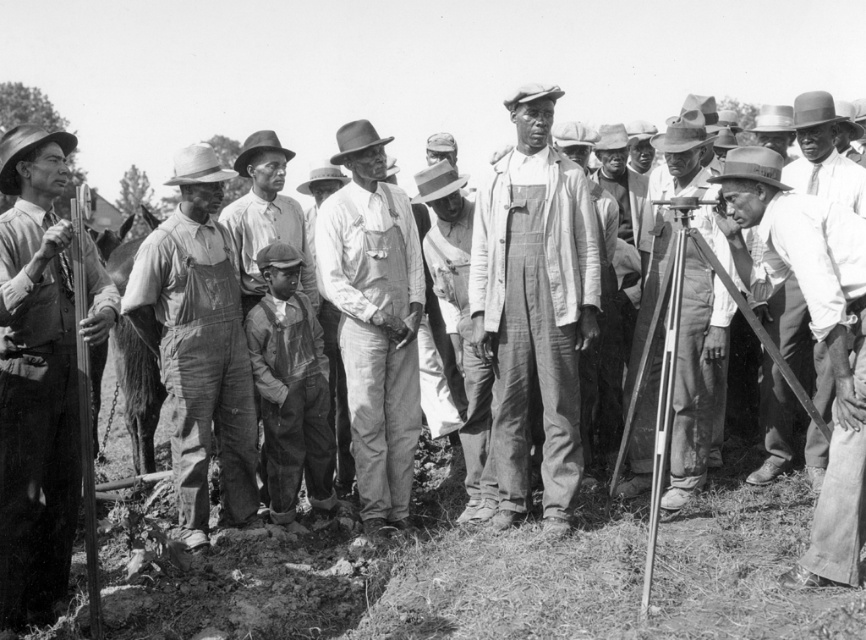
Looking at this image, who is positioned more to the left, matte gray overalls at center or matte metal rod at left?

matte metal rod at left

Where is `matte gray overalls at center`? matte gray overalls at center is located at coordinates (534, 307).

This screenshot has height=640, width=866. What do you see at coordinates (36, 380) in the screenshot? I see `matte metal rod at left` at bounding box center [36, 380].

You are a GUI agent. You are given a task and a screenshot of the screen. Output one action in this format:
    pyautogui.click(x=<x>, y=<y>)
    Task: Click on the matte metal rod at left
    
    Given the screenshot: What is the action you would take?
    pyautogui.click(x=36, y=380)

Between point (57, 588) and point (818, 508), which one is positioned in front?

Positioned in front is point (818, 508).

The image size is (866, 640). What are the coordinates of `matte metal rod at left` in the screenshot? It's located at (36, 380).

Who is shorter, matte metal rod at left or metallic tripod at center right?

With less height is metallic tripod at center right.

Between matte metal rod at left and metallic tripod at center right, which one appears on the left side from the viewer's perspective?

matte metal rod at left

You are a GUI agent. You are given a task and a screenshot of the screen. Output one action in this format:
    pyautogui.click(x=<x>, y=<y>)
    Task: Click on the matte metal rod at left
    This screenshot has width=866, height=640.
    Given the screenshot: What is the action you would take?
    pyautogui.click(x=36, y=380)